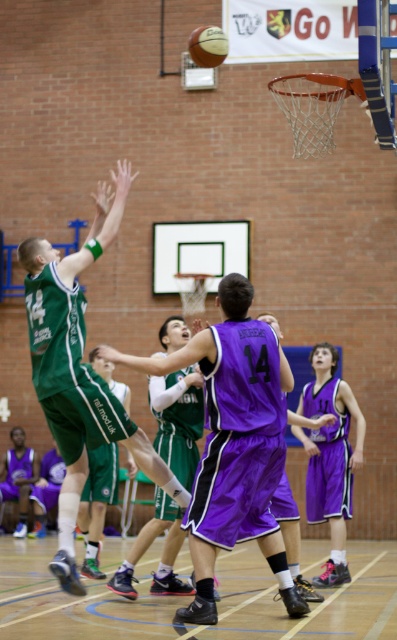
You are a referee standing at the edge of the court. You need to determine if the two purple jerseys at center are too close to each other for a legal play. The minimum required distance between players during a set play is 30 inches. Are the purple shiny jersey at center and the purple jersey at center violating the distance rule?

The purple shiny jersey at center is 29.25 inches away from the purple jersey at center. Since 29.25 inches is less than the required 30 inches, the two purple jerseys at center are violating the distance rule.

You are a spectator sitting in the bleachers and want to know which of the two points, point (x=279, y=566) or point (x=250, y=408), is closer to you. Based on the scene, which point is nearer?

Point (x=279, y=566) is further to the viewer than point (x=250, y=408). Therefore, point (x=250, y=408) is closer to you.